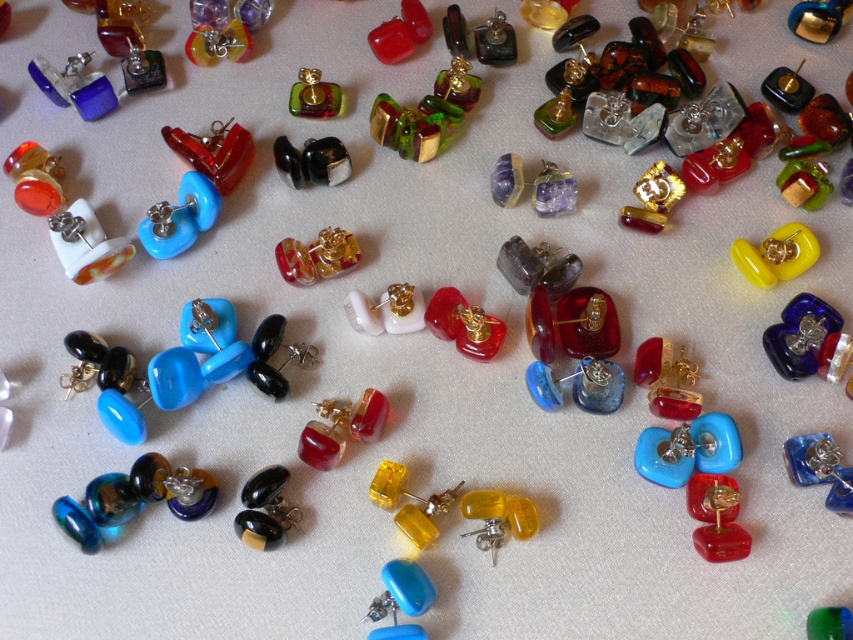
You are a customer looking at the earrings displayed on the white surface. You see the black glossy earrings at center and the yellow translucent earrings at upper right. Which of these two earrings is positioned lower on the surface?

The black glossy earrings at center is positioned lower than the yellow translucent earrings at upper right.

You are a customer at a jewelry store and want to choose an earring that is larger in size between the black glossy earrings at center and the matte red glass earring at center. Which one should you pick?

The matte red glass earring at center is larger in size compared to the black glossy earrings at center, so you should pick the matte red glass earring at center.

You are a jeweler trying to display two earrings on a shelf. You have a glossy red stone at center and a matte red glass earring at center. Which one will you place higher on the shelf to ensure both are visible?

The glossy red stone at center is taller than the matte red glass earring at center, so placing the glossy red stone at center higher on the shelf will ensure both are visible.